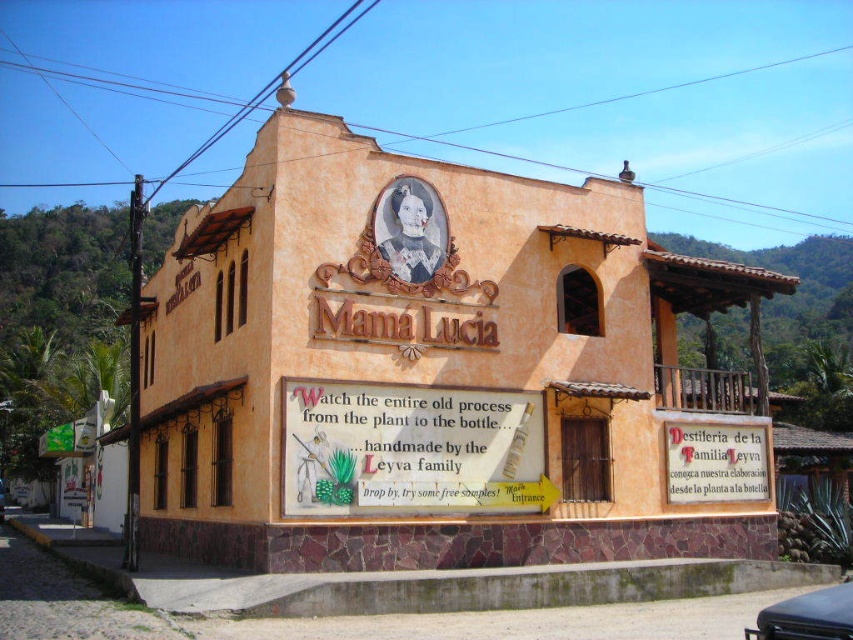
Question: Based on their relative distances, which object is farther from the metallic silver car at center?

Choices:
 (A) black matte car at lower right
 (B) white paper sign at center
 (C) wooden signboard at center

Answer: (A)

Question: Which is farther from the white paper sign at center?

Choices:
 (A) wooden signboard at center
 (B) metallic silver car at center
 (C) black matte car at lower right

Answer: (B)

Question: Does black matte car at lower right have a larger size compared to metallic silver car at center?

Choices:
 (A) no
 (B) yes

Answer: (A)

Question: Does white paper sign at center have a smaller size compared to black matte car at lower right?

Choices:
 (A) no
 (B) yes

Answer: (B)

Question: Which object is positioned farthest from the black matte car at lower right?

Choices:
 (A) white paper sign at center
 (B) wooden signboard at center

Answer: (B)

Question: Is black matte car at lower right to the right of metallic silver car at center from the viewer's perspective?

Choices:
 (A) no
 (B) yes

Answer: (B)